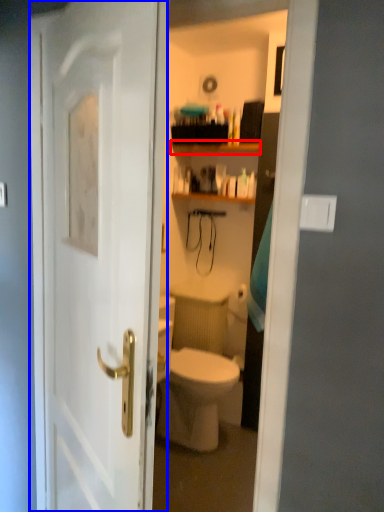
Question: Among these objects, which one is farthest to the camera, shelf (highlighted by a red box) or door (highlighted by a blue box)?

Choices:
 (A) shelf
 (B) door

Answer: (A)